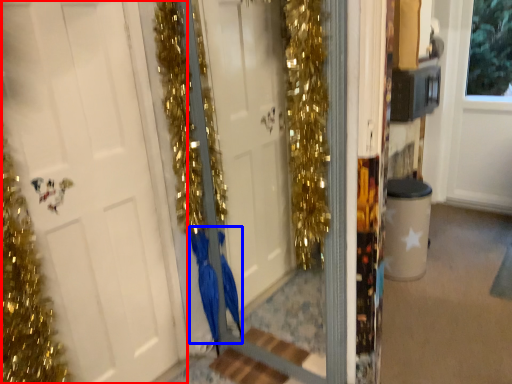
Question: Among these objects, which one is farthest to the camera, door (highlighted by a red box) or dress (highlighted by a blue box)?

Choices:
 (A) door
 (B) dress

Answer: (B)